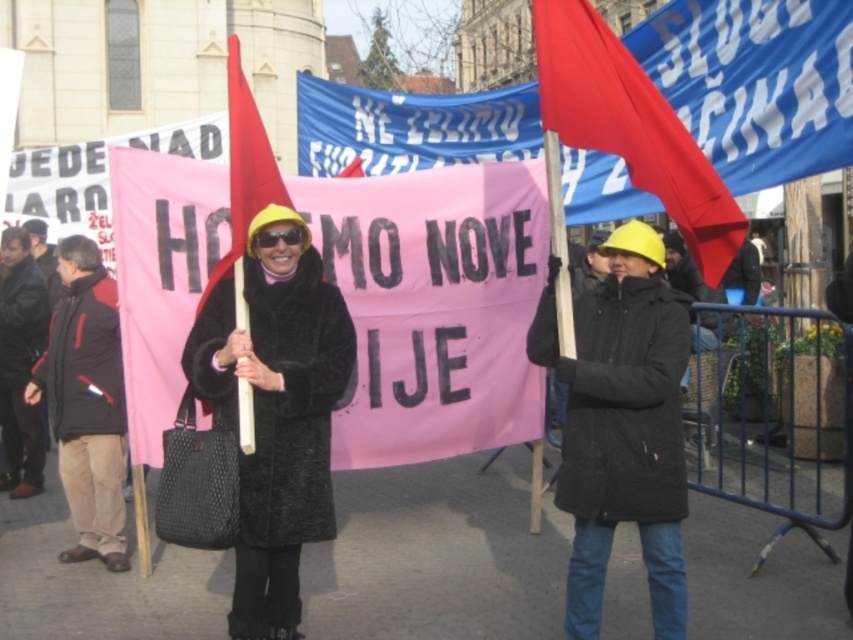
Question: Can you confirm if velvet black coat at center is positioned to the right of matte red flag at upper right?

Choices:
 (A) yes
 (B) no

Answer: (B)

Question: Can you confirm if matte black coat at center is positioned below black leather jacket at left?

Choices:
 (A) no
 (B) yes

Answer: (A)

Question: Based on their relative distances, which object is nearer to the black leather jacket at left?

Choices:
 (A) matte black coat at center
 (B) velvet black coat at center
 (C) black fabric jacket at left

Answer: (C)

Question: Can you confirm if velvet black coat at center is positioned to the right of blue fabric banner at center?

Choices:
 (A) yes
 (B) no

Answer: (B)

Question: Which object is closer to the camera taking this photo?

Choices:
 (A) blue fabric banner at center
 (B) matte black coat at center
 (C) matte red flag at upper right

Answer: (A)

Question: Among these points, which one is farthest from the camera?

Choices:
 (A) (51, 349)
 (B) (608, 48)
 (C) (672, 500)
 (D) (32, 422)

Answer: (D)